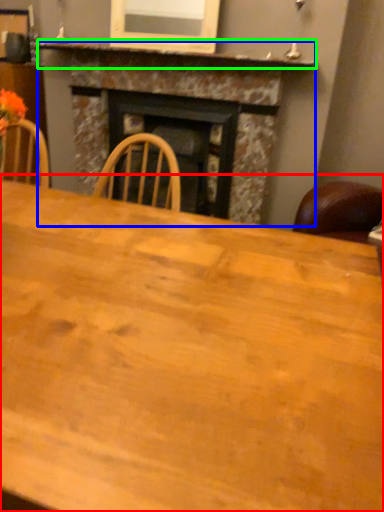
Question: Based on their relative distances, which object is nearer to table (highlighted by a red box)? Choose from fireplace (highlighted by a blue box) and mantle (highlighted by a green box).

Choices:
 (A) fireplace
 (B) mantle

Answer: (A)